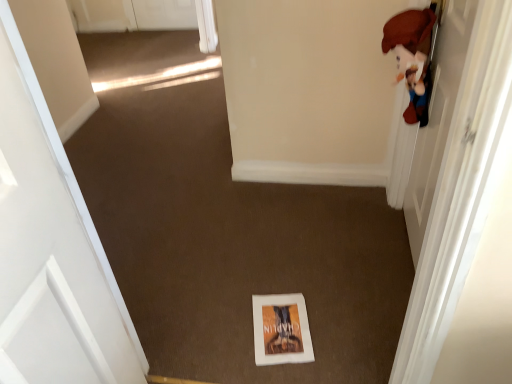
You are a GUI agent. You are given a task and a screenshot of the screen. Output one action in this format:
    pyautogui.click(x=<x>, y=<y>)
    Task: Click on the free space above white paper book at center (from a real-world perspective)
    
    Given the screenshot: What is the action you would take?
    pyautogui.click(x=284, y=324)